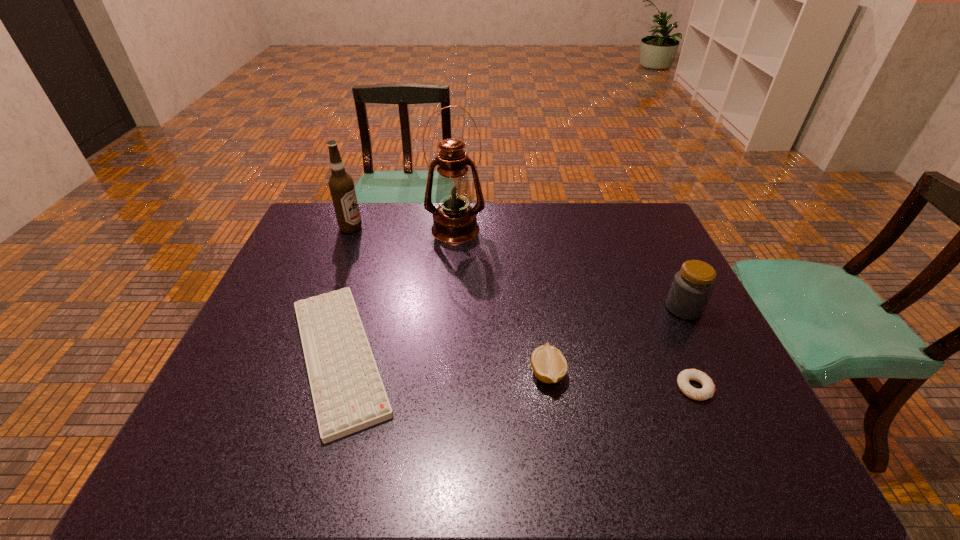
Locate an element on the screen. Image resolution: width=960 pixels, height=540 pixels. the third object from left to right is located at coordinates (454, 221).

I want to click on oil lamp, so click(454, 221).

Where is `alcohol`? The width and height of the screenshot is (960, 540). alcohol is located at coordinates (341, 185).

The width and height of the screenshot is (960, 540). I want to click on the fourth shortest object, so click(x=692, y=286).

This screenshot has width=960, height=540. In order to click on the third object from right to left in this screenshot , I will do `click(549, 365)`.

This screenshot has height=540, width=960. Find the location of `lemon`. lemon is located at coordinates (549, 365).

You are a GUI agent. You are given a task and a screenshot of the screen. Output one action in this format:
    pyautogui.click(x=<x>, y=<y>)
    Task: Click on the computer keyboard
    This screenshot has width=960, height=540.
    Given the screenshot: What is the action you would take?
    pyautogui.click(x=348, y=393)

Locate an element on the screen. This screenshot has width=960, height=540. doughnut is located at coordinates (708, 390).

Where is `free point located 0.370m on the front of the third object from left to right`? Image resolution: width=960 pixels, height=540 pixels. free point located 0.370m on the front of the third object from left to right is located at coordinates (448, 328).

The height and width of the screenshot is (540, 960). Find the location of `vacant space situated 0.080m on the label of the alcohol`. vacant space situated 0.080m on the label of the alcohol is located at coordinates (386, 228).